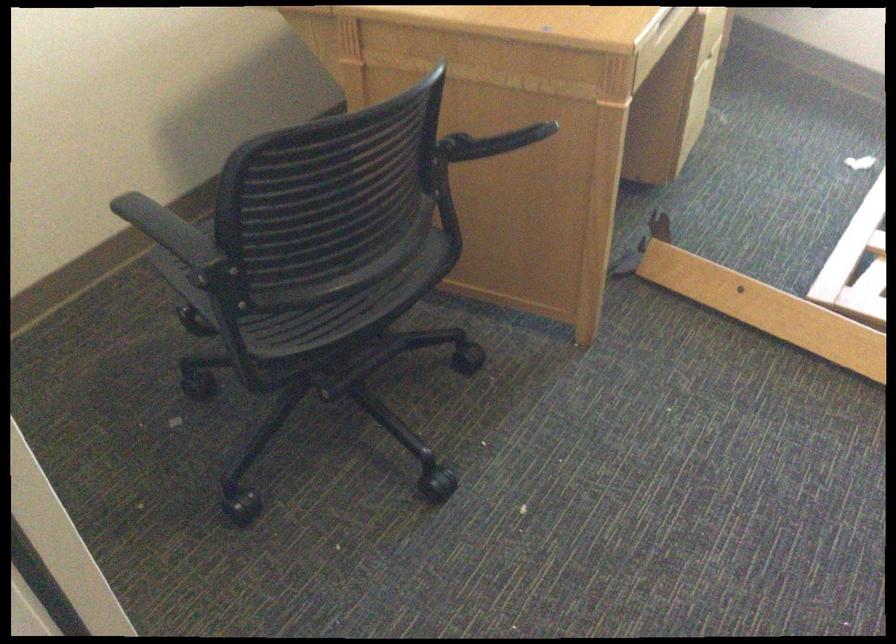
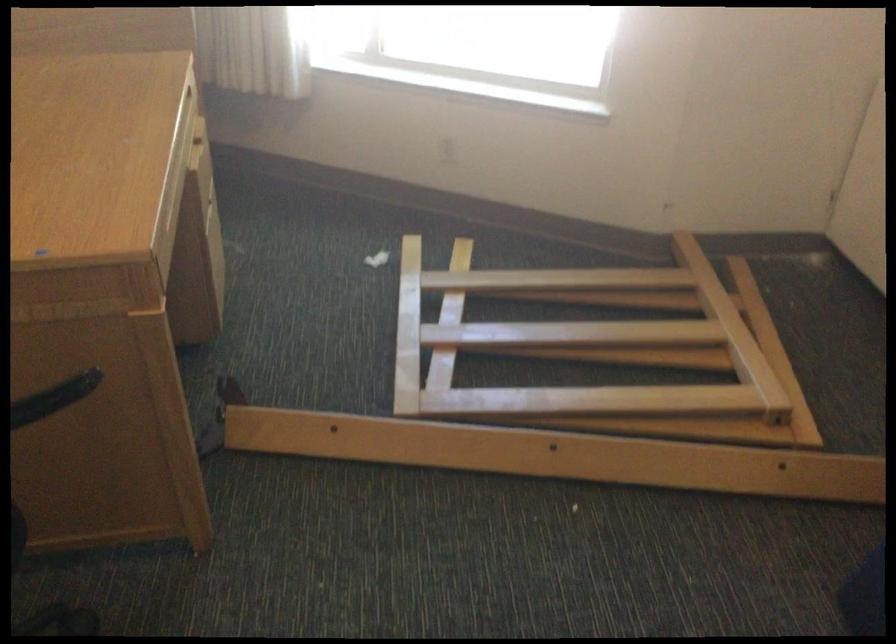
Question: The camera is either moving clockwise (left) or counter-clockwise (right) around the object. The first image is from the beginning of the video and the second image is from the end. Is the camera moving left or right when shooting the video?

Choices:
 (A) Left
 (B) Right

Answer: (A)